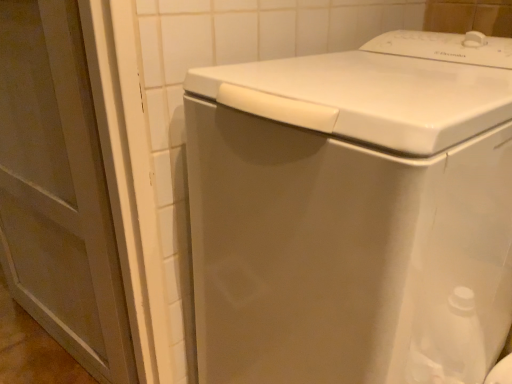
Question: Can you confirm if matte white screen door at left is smaller than white glossy washing machine at center?

Choices:
 (A) yes
 (B) no

Answer: (A)

Question: From a real-world perspective, is matte white screen door at left on white glossy washing machine at center?

Choices:
 (A) yes
 (B) no

Answer: (A)

Question: Is matte white screen door at left turned away from white glossy washing machine at center?

Choices:
 (A) no
 (B) yes

Answer: (A)

Question: Is the surface of matte white screen door at left in direct contact with white glossy washing machine at center?

Choices:
 (A) no
 (B) yes

Answer: (A)

Question: Is matte white screen door at left taller than white glossy washing machine at center?

Choices:
 (A) yes
 (B) no

Answer: (A)

Question: From the image's perspective, does matte white screen door at left appear lower than white glossy washing machine at center?

Choices:
 (A) yes
 (B) no

Answer: (B)

Question: Is the depth of white glossy washing machine at center less than that of matte white screen door at left?

Choices:
 (A) no
 (B) yes

Answer: (B)

Question: Is white glossy washing machine at center taller than matte white screen door at left?

Choices:
 (A) no
 (B) yes

Answer: (A)

Question: Is white glossy washing machine at center further to the viewer compared to matte white screen door at left?

Choices:
 (A) no
 (B) yes

Answer: (A)

Question: Is white glossy washing machine at center turned away from matte white screen door at left?

Choices:
 (A) yes
 (B) no

Answer: (B)

Question: Could you tell me if white glossy washing machine at center is facing matte white screen door at left?

Choices:
 (A) yes
 (B) no

Answer: (B)

Question: Is white glossy washing machine at center at the right side of matte white screen door at left?

Choices:
 (A) yes
 (B) no

Answer: (A)

Question: In terms of size, does white glossy washing machine at center appear bigger or smaller than matte white screen door at left?

Choices:
 (A) small
 (B) big

Answer: (B)